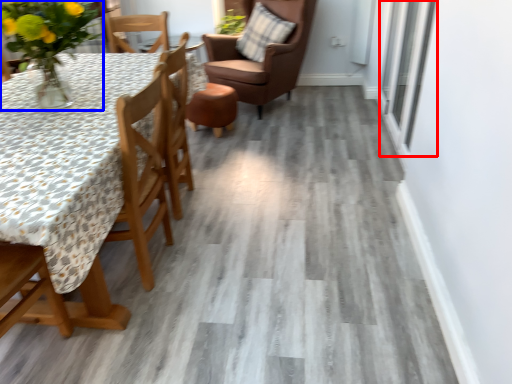
Question: Which object appears farthest to the camera in this image, window (highlighted by a red box) or floral arrangement (highlighted by a blue box)?

Choices:
 (A) window
 (B) floral arrangement

Answer: (A)